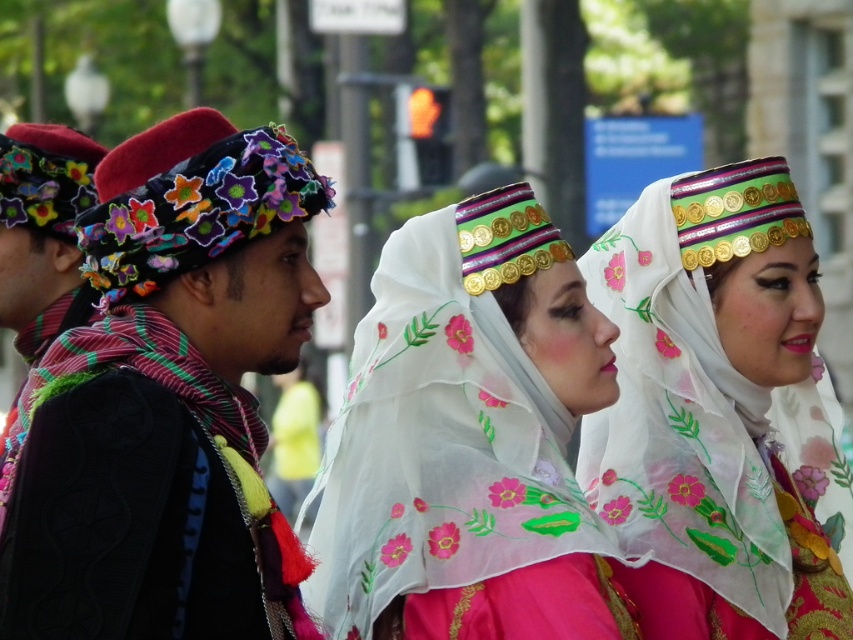
Is multicolored fabric headband at left to the right of translucent floral veil at center from the viewer's perspective?

No, multicolored fabric headband at left is not to the right of translucent floral veil at center.

Who is positioned more to the left, multicolored fabric headband at left or translucent floral veil at center?

Positioned to the left is multicolored fabric headband at left.

Between point (209, 156) and point (399, 349), which one is positioned behind?

The point (399, 349) is behind.

Identify the location of multicolored fabric headband at left. (167, 404).

Which is more to the left, translucent floral veil at center or embroidered silk veil at center?

From the viewer's perspective, translucent floral veil at center appears more on the left side.

Between point (549, 544) and point (804, 618), which one is positioned behind?

Point (804, 618)

The width and height of the screenshot is (853, 640). In order to click on translucent floral veil at center in this screenshot , I will do `click(468, 440)`.

Can you confirm if multicolored fabric headband at left is bigger than embroidered silk veil at center?

Indeed, multicolored fabric headband at left has a larger size compared to embroidered silk veil at center.

This screenshot has height=640, width=853. What are the coordinates of `multicolored fabric headband at left` in the screenshot? It's located at (167, 404).

This screenshot has height=640, width=853. What are the coordinates of `multicolored fabric headband at left` in the screenshot? It's located at (167, 404).